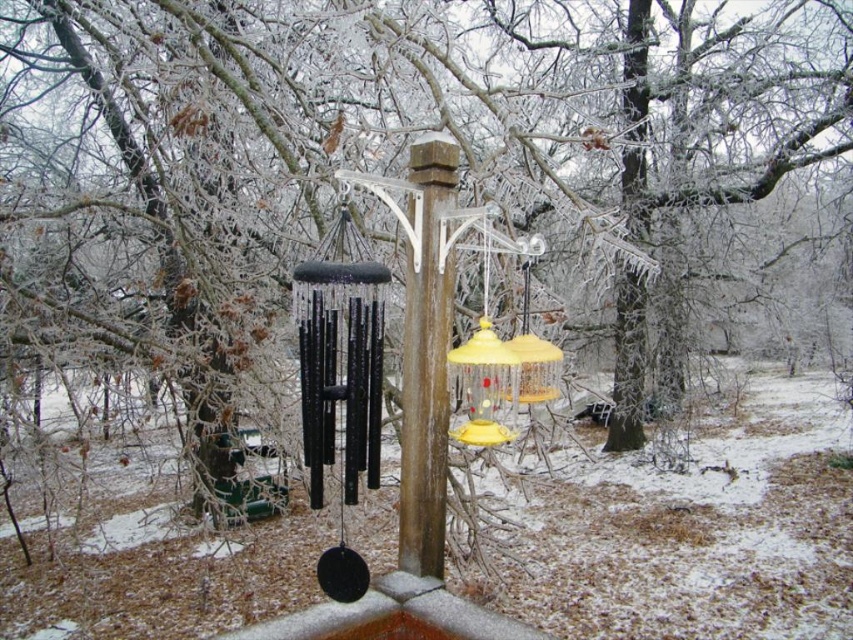
Question: Does black metallic wind chime at center have a smaller size compared to brown wood post at center?

Choices:
 (A) yes
 (B) no

Answer: (B)

Question: Observing the image, what is the correct spatial positioning of black metallic wind chime at center in reference to brown wood post at center?

Choices:
 (A) right
 (B) left

Answer: (B)

Question: Which of the following is the farthest from the observer?

Choices:
 (A) brown wood post at center
 (B) black metallic wind chime at center

Answer: (A)

Question: Is black metallic wind chime at center bigger than brown wood post at center?

Choices:
 (A) no
 (B) yes

Answer: (B)

Question: Among these objects, which one is farthest from the camera?

Choices:
 (A) black metallic wind chime at center
 (B) brown wood post at center

Answer: (B)

Question: Which point is farther to the camera?

Choices:
 (A) (332, 355)
 (B) (433, 328)

Answer: (B)